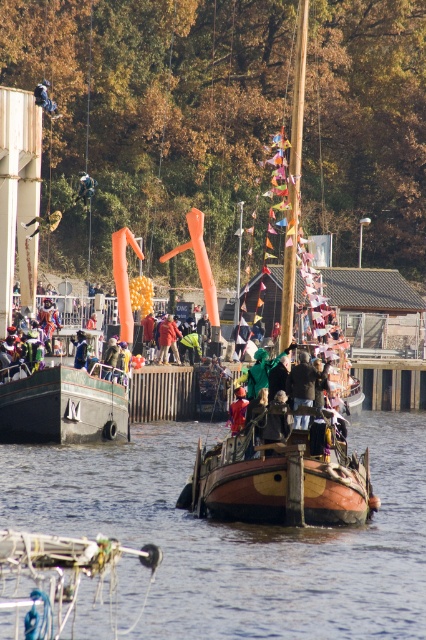
You are standing on the wooden boat at the river festival and want to find the green fabric jacket at center. According to the coordinates provided, where exactly should you look to locate it?

The green fabric jacket at center is located at coordinates point [109,356].

You are standing on the wooden boat at the festive event. You see the dark brown leather jacket at center and the blue fabric person at center. Which one is closer to you?

The dark brown leather jacket at center is closer to you because it is in front of the blue fabric person at center.